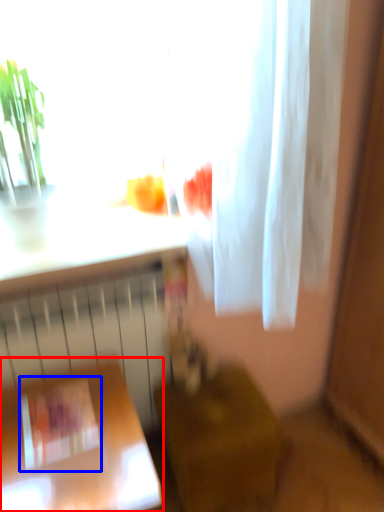
Question: Which of the following is the farthest to the observer, furniture (highlighted by a red box) or square (highlighted by a blue box)?

Choices:
 (A) furniture
 (B) square

Answer: (B)